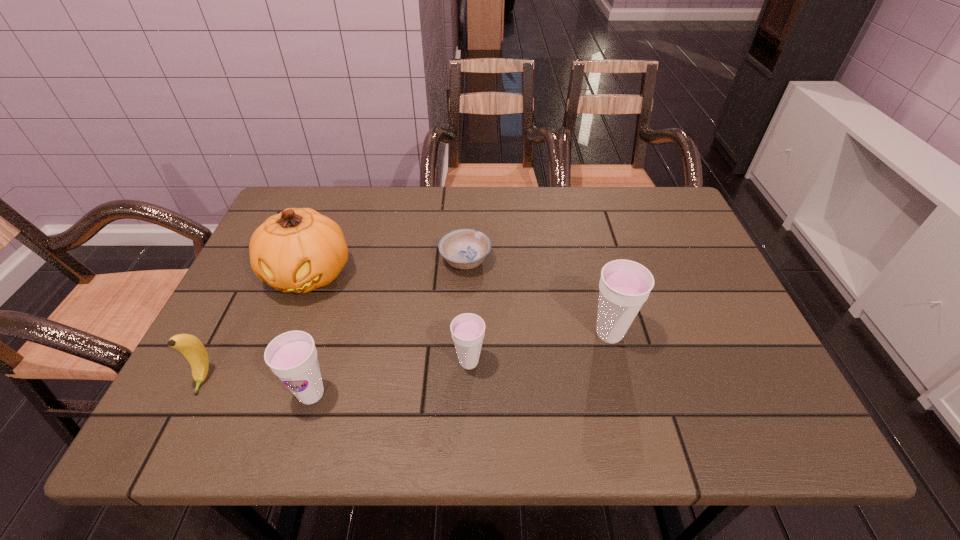
The width and height of the screenshot is (960, 540). In the image, there is a desktop. Find the location of `free region at the far right corner`. free region at the far right corner is located at coordinates (643, 188).

Identify the location of free spot at the near right corner of the desktop. (776, 388).

Where is `free spot between the shortest object and the rightmost object`? Image resolution: width=960 pixels, height=540 pixels. free spot between the shortest object and the rightmost object is located at coordinates (538, 297).

You are a GUI agent. You are given a task and a screenshot of the screen. Output one action in this format:
    pyautogui.click(x=<x>, y=<y>)
    Task: Click on the free space between the pumpkin and the bowl
    
    Given the screenshot: What is the action you would take?
    pyautogui.click(x=387, y=267)

This screenshot has height=540, width=960. Identify the location of free area in between the pumpkin and the banana. (256, 327).

You are a GUI agent. You are given a task and a screenshot of the screen. Output one action in this format:
    pyautogui.click(x=<x>, y=<y>)
    Task: Click on the vacant space that is in between the second tallest cup and the second cup from left to right
    
    Given the screenshot: What is the action you would take?
    pyautogui.click(x=390, y=378)

Image resolution: width=960 pixels, height=540 pixels. I want to click on free space between the banana and the bowl, so click(334, 320).

Where is `empty space that is in between the second cup from right to left and the tallest cup`? The width and height of the screenshot is (960, 540). empty space that is in between the second cup from right to left and the tallest cup is located at coordinates (540, 348).

Where is `vacant space that's between the second tallest cup and the second cup from left to right`? The height and width of the screenshot is (540, 960). vacant space that's between the second tallest cup and the second cup from left to right is located at coordinates click(x=390, y=378).

Where is `free spot between the leftmost cup and the leftmost object`? This screenshot has width=960, height=540. free spot between the leftmost cup and the leftmost object is located at coordinates (257, 386).